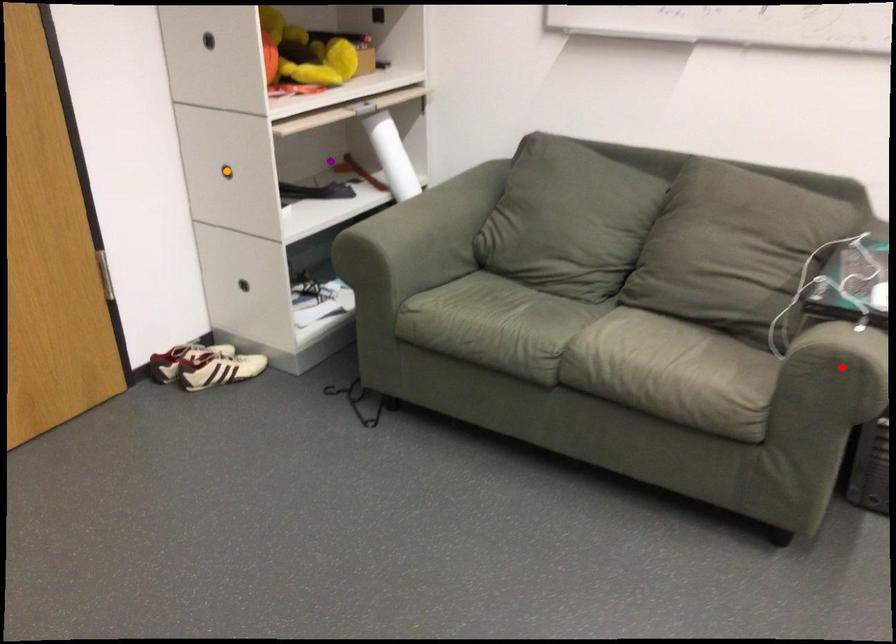
Consider the image. Order these from farthest to nearest:
red point, orange point, purple point

purple point → orange point → red point